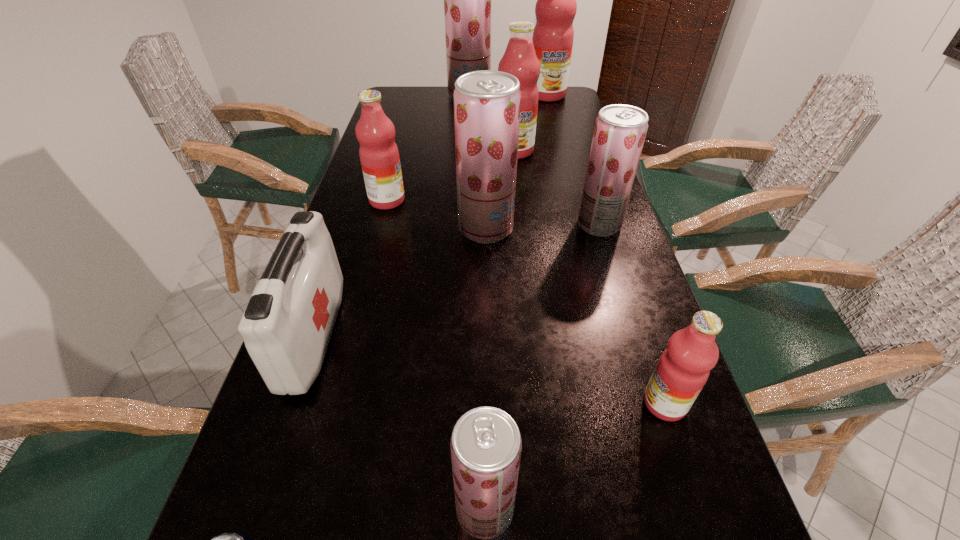
Where is `blank space located 0.390m on the front side of the first-aid kit`? This screenshot has width=960, height=540. blank space located 0.390m on the front side of the first-aid kit is located at coordinates (525, 336).

You are a GUI agent. You are given a task and a screenshot of the screen. Output one action in this format:
    pyautogui.click(x=<x>, y=<y>)
    Task: Click on the fruit juice at the left edge
    This screenshot has height=540, width=960.
    Given the screenshot: What is the action you would take?
    pyautogui.click(x=379, y=156)

Locate an element on the screen. Image resolution: width=960 pixels, height=540 pixels. the first-aid kit present at the left edge is located at coordinates (286, 327).

You are a GUI agent. You are given a task and a screenshot of the screen. Output one action in this format:
    pyautogui.click(x=<x>, y=<y>)
    Task: Click on the object located in the far right corner section of the desktop
    The image size is (960, 540).
    Given the screenshot: What is the action you would take?
    pyautogui.click(x=556, y=7)

Locate an element on the screen. vacant space at the left edge of the desktop is located at coordinates (414, 119).

I want to click on free space at the right edge of the desktop, so click(624, 239).

This screenshot has width=960, height=540. Identify the location of empty space between the sixth nearest fruit juice and the seventh farthest fruit juice. (589, 277).

This screenshot has width=960, height=540. What are the coordinates of `vacant area that lies between the farthest strawberry fruit juice and the red first-aid kit` in the screenshot? It's located at (392, 215).

The height and width of the screenshot is (540, 960). In order to click on free space between the second biggest strawberry fruit juice and the red first-aid kit in this screenshot , I will do `click(400, 282)`.

At what (x,y) coordinates should I click in order to perform the action: click on free space between the second nearest fruit juice and the third farthest object. Please return your answer as a coordinate pair (x, y). This screenshot has height=540, width=960. Looking at the image, I should click on (589, 277).